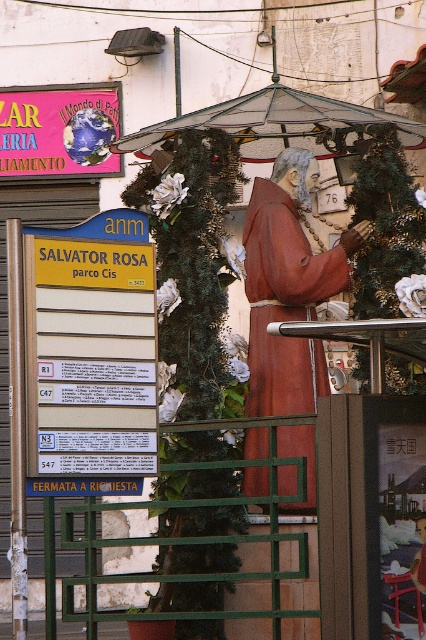
Is point (265, 448) farther from viewer compared to point (342, 102)?

No, it is not.

Does matte brown robe at center come in front of stained glass canopy at center?

Yes, it is.

Does point (302, 376) lie in front of point (270, 154)?

Yes.

This screenshot has height=640, width=426. What are the coordinates of `matte brown robe at center` in the screenshot? It's located at pos(284,301).

Which is above, stained glass canopy at center or pink paper sign at upper left?

pink paper sign at upper left

Is point (247, 132) positioned behind point (36, 106)?

No, it is in front of (36, 106).

You are a GUI agent. You are given a task and a screenshot of the screen. Output one action in this format:
    pyautogui.click(x=<x>, y=<y>)
    Task: Click on the stained glass canopy at center
    
    Given the screenshot: What is the action you would take?
    pyautogui.click(x=273, y=124)

Is point (63, 369) positioned after point (57, 138)?

No, (63, 369) is closer to viewer.

Can you confirm if yellow plastic sign at center left is bigger than pink paper sign at upper left?

Indeed, yellow plastic sign at center left has a larger size compared to pink paper sign at upper left.

Between point (77, 227) and point (2, 129), which one is positioned in front?

Positioned in front is point (77, 227).

Find the location of a particular element. This screenshot has width=426, height=640. yellow plastic sign at center left is located at coordinates (91, 353).